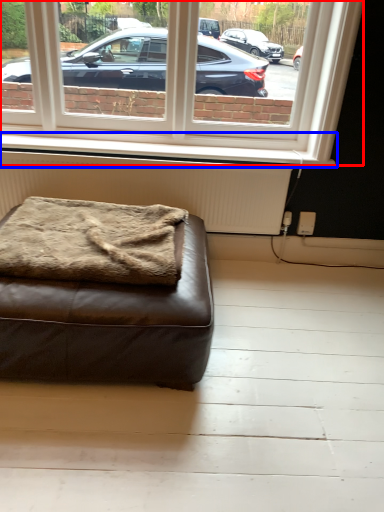
Question: Among these objects, which one is nearest to the camera, window (highlighted by a red box) or window sill (highlighted by a blue box)?

Choices:
 (A) window
 (B) window sill

Answer: (A)